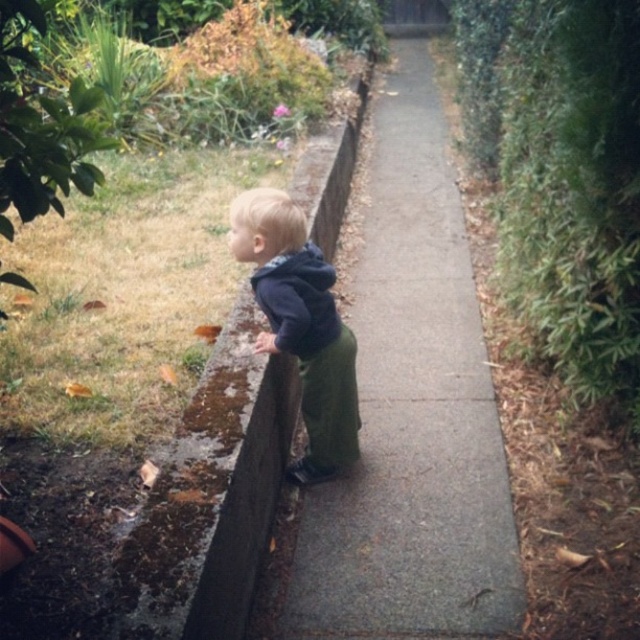
Between concrete at center and slate gray concrete at center, which one has more height?

With more height is slate gray concrete at center.

Is concrete at center above slate gray concrete at center?

No.

Between point (372, 173) and point (340, 125), which one is positioned in front?

Point (340, 125)

The height and width of the screenshot is (640, 640). What are the coordinates of `concrete at center` in the screenshot? It's located at (406, 410).

Can you confirm if slate gray concrete at center is bigger than dark blue hoodie at center?

Correct, slate gray concrete at center is larger in size than dark blue hoodie at center.

Describe the element at coordinates (237, 468) in the screenshot. This screenshot has height=640, width=640. I see `slate gray concrete at center` at that location.

You are a GUI agent. You are given a task and a screenshot of the screen. Output one action in this format:
    pyautogui.click(x=<x>, y=<y>)
    Task: Click on the slate gray concrete at center
    This screenshot has height=640, width=640.
    Given the screenshot: What is the action you would take?
    pyautogui.click(x=237, y=468)

Based on the photo, which is below, concrete at center or dark blue hoodie at center?

Positioned lower is concrete at center.

Between point (342, 288) and point (260, 300), which one is positioned in front?

Point (260, 300) is more forward.

Where is `concrete at center`? concrete at center is located at coordinates (406, 410).